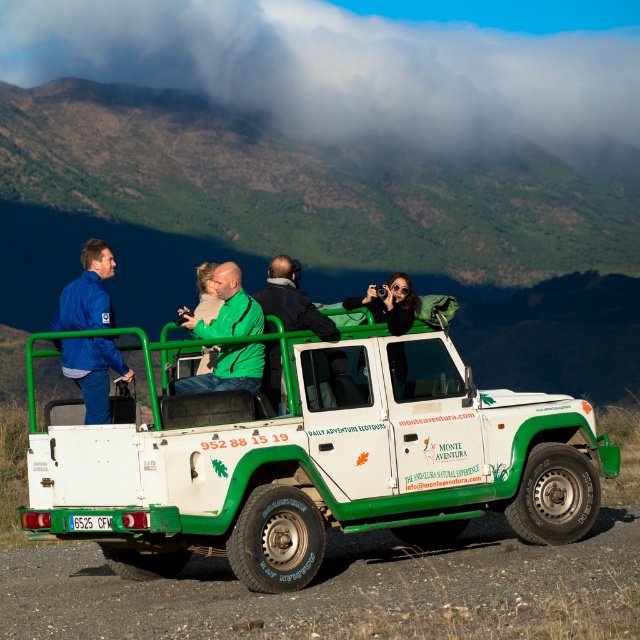
Question: Is white matte jeep at center closer to the viewer compared to dark green jacket at center?

Choices:
 (A) no
 (B) yes

Answer: (B)

Question: Does green matte vehicle at center appear under dark green jacket at center?

Choices:
 (A) no
 (B) yes

Answer: (A)

Question: Estimate the real-world distances between objects in this image. Which object is farther from the dark green jacket at center?

Choices:
 (A) white matte jeep at center
 (B) blue matte jacket at left

Answer: (B)

Question: Which object appears farthest from the camera in this image?

Choices:
 (A) green matte vehicle at center
 (B) blue matte jacket at left

Answer: (A)

Question: Among these objects, which one is nearest to the camera?

Choices:
 (A) white matte jeep at center
 (B) green matte jacket at center
 (C) dark green jacket at center

Answer: (A)

Question: Is green matte vehicle at center to the left of green matte jacket at center from the viewer's perspective?

Choices:
 (A) yes
 (B) no

Answer: (A)